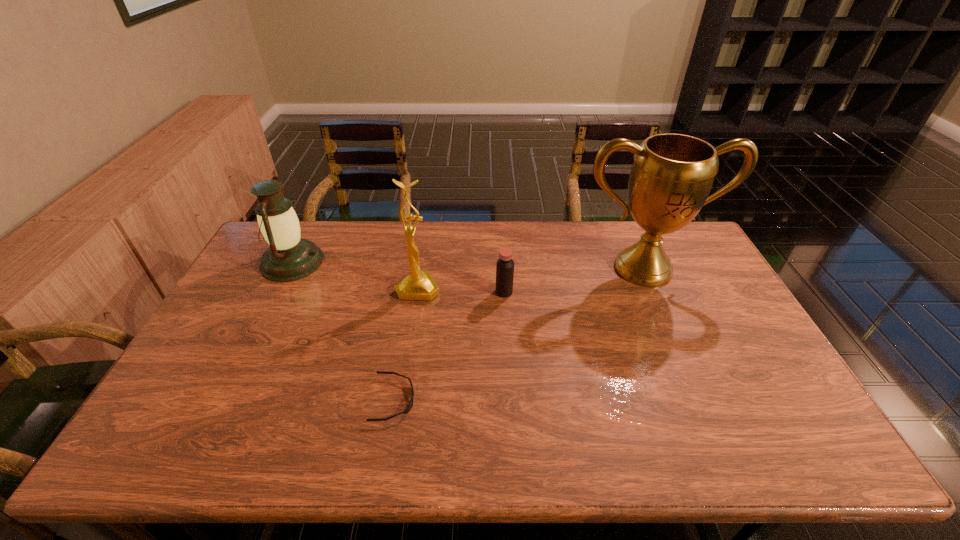
What are the coordinates of `vacant space at the far edge` in the screenshot? It's located at (422, 259).

Where is `free space at the near edge`? Image resolution: width=960 pixels, height=540 pixels. free space at the near edge is located at coordinates (233, 437).

Where is `free space at the left edge of the desktop`? The height and width of the screenshot is (540, 960). free space at the left edge of the desktop is located at coordinates (x=252, y=329).

I want to click on vacant space at the right edge, so click(783, 397).

Where is `vacant space that is in between the award and the rightmost object`? The width and height of the screenshot is (960, 540). vacant space that is in between the award and the rightmost object is located at coordinates (531, 278).

At what (x,y) coordinates should I click in order to perform the action: click on free area in between the shortest object and the vinegar. Please return your answer as a coordinate pair (x, y). Looking at the image, I should click on point(449,346).

Where is `free spot between the tallest object and the nearest object`? free spot between the tallest object and the nearest object is located at coordinates (518, 334).

Locate an element on the screen. This screenshot has height=540, width=960. vacant space that's between the shortest object and the second object from right to left is located at coordinates (449, 346).

At what (x,y) coordinates should I click in order to perform the action: click on vacant area that lies between the trophy cup and the third shortest object. Please return your answer as a coordinate pair (x, y). The image size is (960, 540). Looking at the image, I should click on (468, 265).

Find the location of `unoccupied area between the third shortest object and the tallest object`. unoccupied area between the third shortest object and the tallest object is located at coordinates (468, 265).